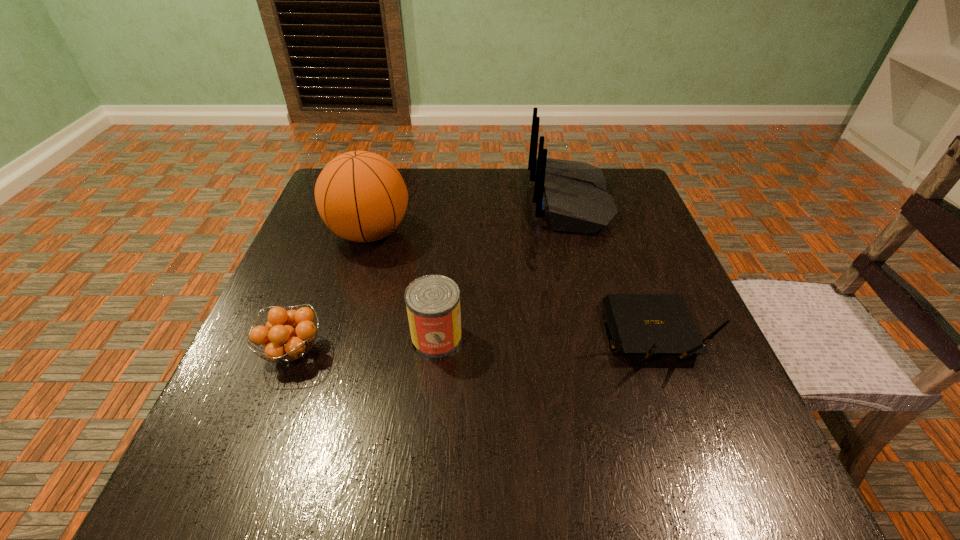
The width and height of the screenshot is (960, 540). I want to click on blank space at the near edge of the desktop, so click(383, 448).

Where is `vacant space at the left edge`? The image size is (960, 540). vacant space at the left edge is located at coordinates (334, 247).

Find the location of a particular element. free space at the right edge is located at coordinates (614, 256).

At what (x,y) coordinates should I click in order to perform the action: click on free space at the near left corner of the desktop. Please return your answer as a coordinate pair (x, y). Looking at the image, I should click on (257, 501).

The image size is (960, 540). I want to click on free space at the near right corner, so click(674, 499).

Identify the location of vacant point located between the can and the orange fruit. (365, 345).

Locate an element on the screen. vacant space that's between the third object from right to left and the basketball is located at coordinates (403, 285).

Where is `vacant area that lies between the shorter router and the basketball`? This screenshot has height=540, width=960. vacant area that lies between the shorter router and the basketball is located at coordinates (509, 284).

Find the location of `free space between the orange fruit and the basketball`. free space between the orange fruit and the basketball is located at coordinates (331, 292).

In order to click on free space between the shorter router and the can in this screenshot , I will do click(x=542, y=336).